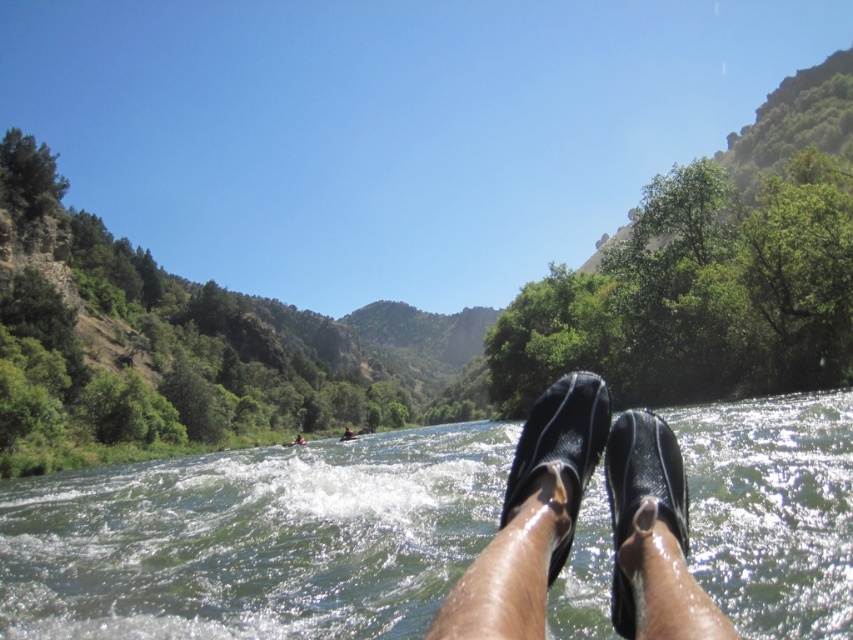
You are a photographer trying to capture a photo of the brown leather kayak at center while standing on the black rubber sandals at center. Since both are in the center, where should you shift your body to get the kayak centered in your viewfinder?

You should shift your body to the left because the black rubber sandals at center are on the right side of the brown leather kayak at center, so moving left would center the kayak in your viewfinder.

You are navigating a river in a raft and need to reach the green rubber boots at lower center located at point (254, 538). The river has rapids ahead. Based on the scene description, what should you be cautious of while approaching the boots?

You should be cautious of the rapids ahead as the water is choppy with white foam, indicating strong currents and potential obstacles that could make navigating to the green rubber boots at lower center dangerous.

You are a photographer trying to capture a clear shot of the black rubber sandals at center and the brown leather kayak at center. Since you want both objects in focus, you need to know which one is closer to you. Can you determine which object is nearer based on their heights in the image?

The black rubber sandals at center has a lesser height compared to the brown leather kayak at center, so the kayak is closer to you because objects closer to the camera appear larger in the image.